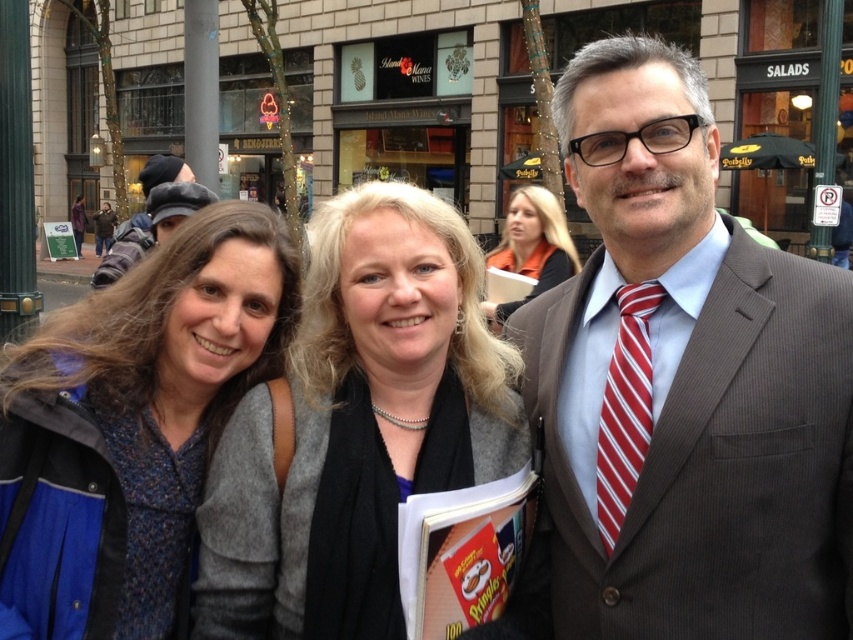
Which is more to the right, blue textured jacket at left or red striped tie at right?

red striped tie at right is more to the right.

Is blue textured jacket at left below red striped tie at right?

Incorrect, blue textured jacket at left is not positioned below red striped tie at right.

Locate an element on the screen. blue textured jacket at left is located at coordinates (132, 426).

Where is `blue textured jacket at left`? This screenshot has width=853, height=640. blue textured jacket at left is located at coordinates (132, 426).

Who is lower down, smooth gray sweater at center or dark gray knit hat at upper left?

smooth gray sweater at center is lower down.

Is smooth gray sweater at center above dark gray knit hat at upper left?

No.

Identify the location of smooth gray sweater at center. This screenshot has height=640, width=853. (358, 426).

Is smooth gray sweater at center above blue textured jacket at left?

No.

Is smooth gray sweater at center closer to camera compared to blue textured jacket at left?

No, smooth gray sweater at center is further to the viewer.

The width and height of the screenshot is (853, 640). I want to click on smooth gray sweater at center, so click(x=358, y=426).

Locate an element on the screen. smooth gray sweater at center is located at coordinates (358, 426).